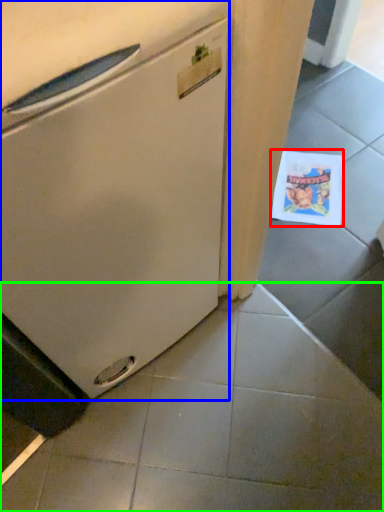
Question: Estimate the real-world distances between objects in this image. Which object is farther from postcard (highlighted by a red box), refrigerator (highlighted by a blue box) or tile (highlighted by a green box)?

Choices:
 (A) refrigerator
 (B) tile

Answer: (A)